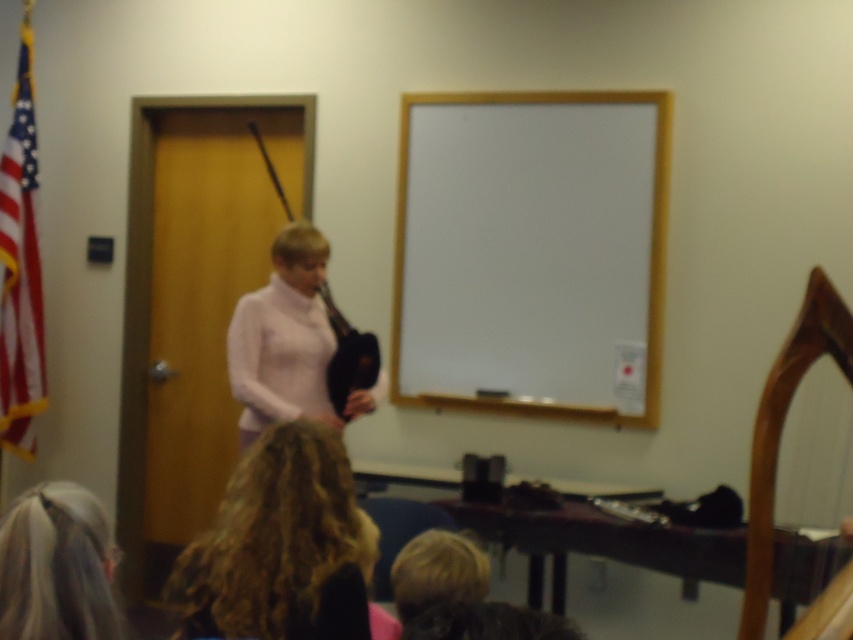
You are an attendee at a presentation and you see the blonde hair at lower center and the matte black bagpipe at center. Which object is positioned lower in the image?

The blonde hair at lower center is positioned below the matte black bagpipe at center, so it is lower in the image.

You are organizing a school event and need to arrange seating for participants. The room has limited space. You notice the blonde hair at lower center and the matte black bagpipe at center. Which object takes up more horizontal space?

The matte black bagpipe at center takes up more horizontal space since its width is greater than the blonde hair at lower center.

You are an observer in the room. You notice two people with blonde hair at lower center and blonde hair at lower left. Which one is closer to you?

The blonde hair at lower center is closer to you because it appears larger in size than the blonde hair at lower left.